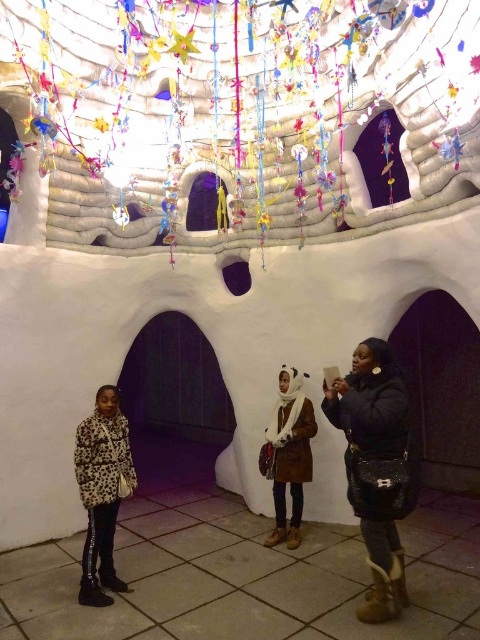
Is leopard print coat at lower left smaller than white fluffy scarf at center?

Indeed, leopard print coat at lower left has a smaller size compared to white fluffy scarf at center.

Image resolution: width=480 pixels, height=640 pixels. What do you see at coordinates (101, 492) in the screenshot?
I see `leopard print coat at lower left` at bounding box center [101, 492].

You are a GUI agent. You are given a task and a screenshot of the screen. Output one action in this format:
    pyautogui.click(x=<x>, y=<y>)
    Task: Click on the leopard print coat at lower left
    
    Given the screenshot: What is the action you would take?
    pyautogui.click(x=101, y=492)

Does black quilted purse at lower right have a smaller size compared to leopard print coat at lower left?

No.

Does black quilted purse at lower right have a greater height compared to leopard print coat at lower left?

Yes, black quilted purse at lower right is taller than leopard print coat at lower left.

Is point (387, 509) positioned behind point (120, 417)?

No, it is not.

Identify the location of black quilted purse at lower right. Image resolution: width=480 pixels, height=640 pixels. (376, 467).

Between point (400, 488) and point (276, 474), which one is positioned behind?

The point (276, 474) is behind.

Is point (403, 413) farther from viewer compared to point (292, 500)?

That is False.

Is point (396, 381) positioned behind point (280, 396)?

No, it is not.

Locate an element on the screen. The image size is (480, 640). black quilted purse at lower right is located at coordinates (376, 467).